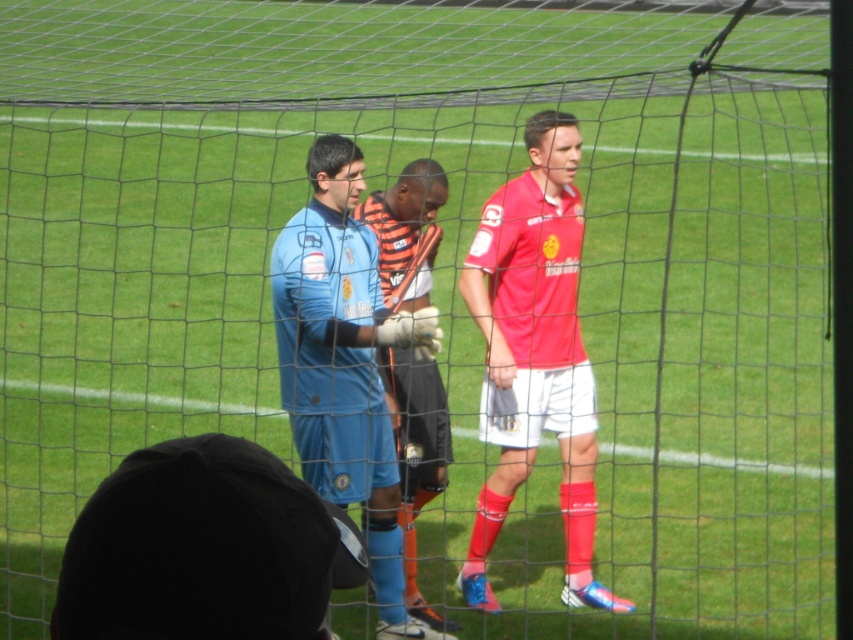
Does matte red jersey at center appear on the right side of blue matte jersey at center?

Yes, matte red jersey at center is to the right of blue matte jersey at center.

The height and width of the screenshot is (640, 853). Identify the location of matte red jersey at center. (534, 355).

Does point (111, 520) lie behind point (589, 417)?

No, it is not.

Which is behind, point (86, 524) or point (471, 540)?

Point (471, 540)

The image size is (853, 640). Identify the location of blue jersey at center. 204,548.

The image size is (853, 640). I want to click on blue jersey at center, so click(204, 548).